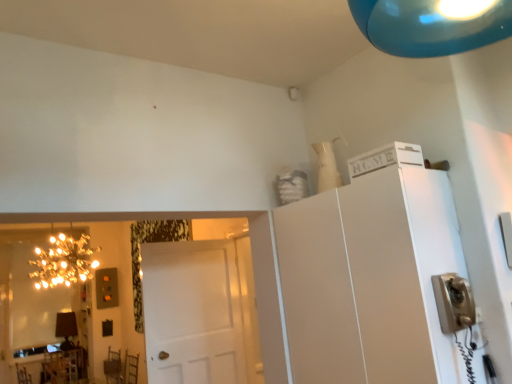
Question: Would you say matte black lamp at lower left is a long distance from white matte door at center?

Choices:
 (A) no
 (B) yes

Answer: (B)

Question: From the image's perspective, is matte black lamp at lower left beneath white matte door at center?

Choices:
 (A) yes
 (B) no

Answer: (A)

Question: Considering the relative positions of matte black lamp at lower left and white matte door at center in the image provided, is matte black lamp at lower left to the left of white matte door at center from the viewer's perspective?

Choices:
 (A) yes
 (B) no

Answer: (A)

Question: Is matte black lamp at lower left outside white matte door at center?

Choices:
 (A) no
 (B) yes

Answer: (B)

Question: Is matte black lamp at lower left next to white matte door at center?

Choices:
 (A) no
 (B) yes

Answer: (A)

Question: Is point (428, 235) positioned closer to the camera than point (23, 311)?

Choices:
 (A) closer
 (B) farther

Answer: (A)

Question: Is white matte cabinet at upper right taller or shorter than gold reflective mirror at left?

Choices:
 (A) tall
 (B) short

Answer: (B)

Question: From a real-world perspective, is white matte cabinet at upper right positioned above or below gold reflective mirror at left?

Choices:
 (A) below
 (B) above

Answer: (A)

Question: Is white matte cabinet at upper right bigger or smaller than gold reflective mirror at left?

Choices:
 (A) small
 (B) big

Answer: (B)

Question: Is gold reflective mirror at left wider or thinner than wooden table at lower left?

Choices:
 (A) thin
 (B) wide

Answer: (A)

Question: From their relative heights in the image, would you say gold reflective mirror at left is taller or shorter than wooden table at lower left?

Choices:
 (A) short
 (B) tall

Answer: (B)

Question: Is gold reflective mirror at left inside the boundaries of wooden table at lower left, or outside?

Choices:
 (A) inside
 (B) outside

Answer: (B)

Question: From the image's perspective, is gold reflective mirror at left located above or below wooden table at lower left?

Choices:
 (A) below
 (B) above

Answer: (B)

Question: From the image's perspective, is white matte door at center located above or below gold reflective mirror at left?

Choices:
 (A) above
 (B) below

Answer: (A)

Question: Is white matte door at center taller or shorter than gold reflective mirror at left?

Choices:
 (A) short
 (B) tall

Answer: (A)